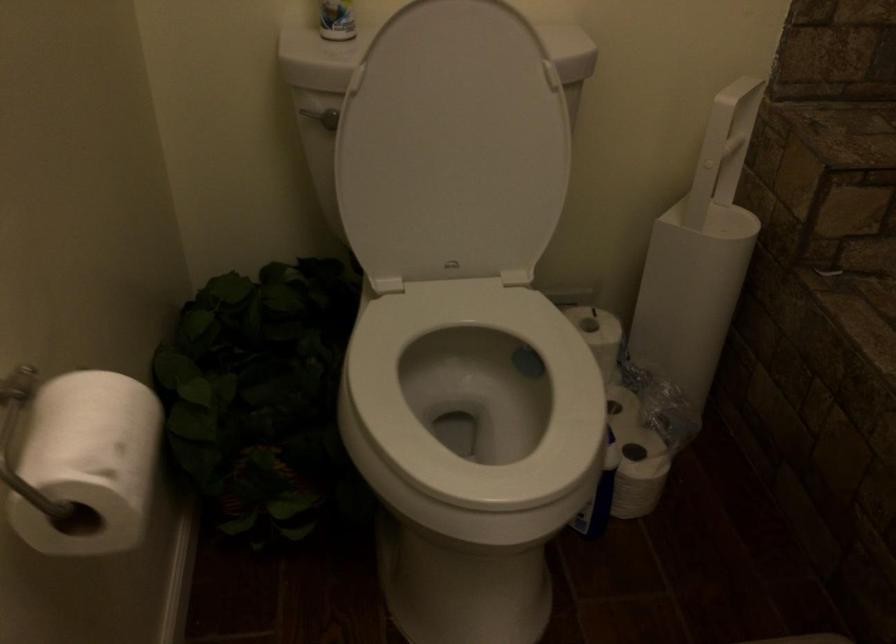
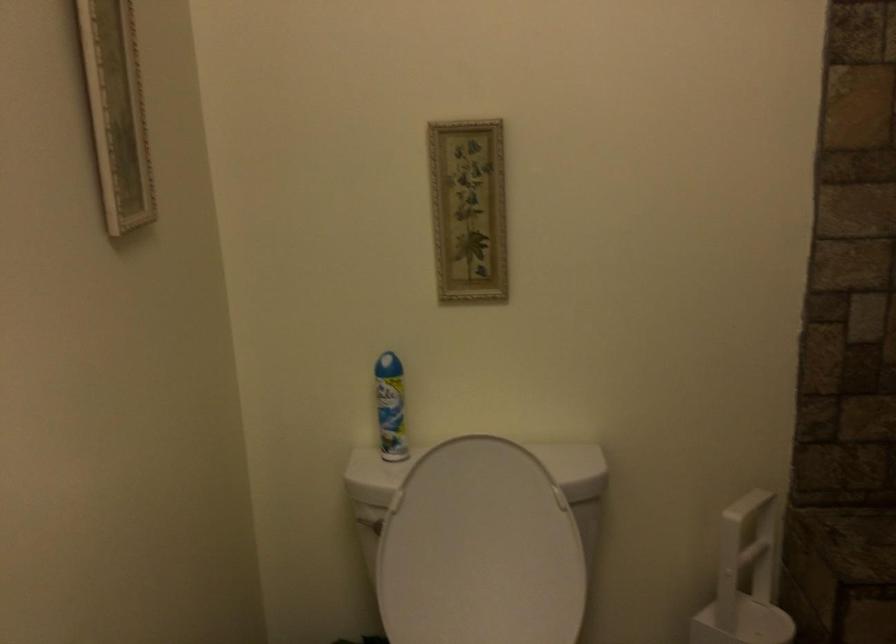
Locate, in the second image, the point that corresponds to [453,142] in the first image.

(479, 550)